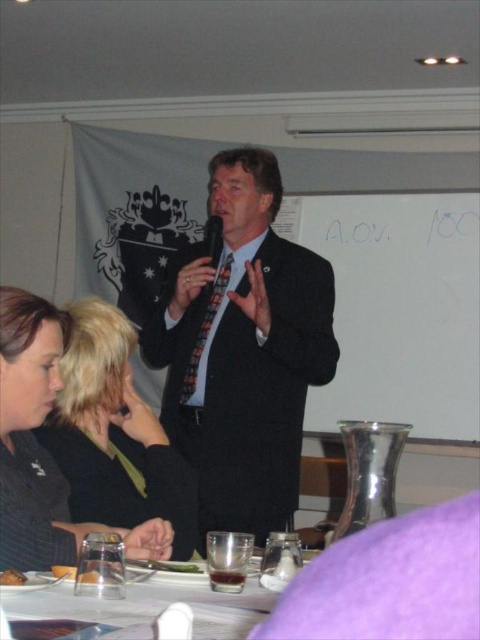
Based on the photo, does matte black suit at center have a lesser height compared to clear glass at lower center?

In fact, matte black suit at center may be taller than clear glass at lower center.

Is point (229, 326) behind point (236, 611)?

That is True.

At what (x,y) coordinates should I click in order to perform the action: click on matte black suit at center. Please return your answer as a coordinate pair (x, y). This screenshot has height=640, width=480. Looking at the image, I should click on (242, 349).

Is point (94, 317) less distant than point (202, 326)?

Yes, it is in front of point (202, 326).

The height and width of the screenshot is (640, 480). What do you see at coordinates (115, 435) in the screenshot?
I see `black fabric hair at center` at bounding box center [115, 435].

This screenshot has height=640, width=480. What are the coordinates of `black fabric hair at center` in the screenshot? It's located at (115, 435).

Is black fabric hair at center closer to camera compared to clear glass at lower center?

No, it is behind clear glass at lower center.

Is black fabric hair at center thinner than clear glass at lower center?

In fact, black fabric hair at center might be wider than clear glass at lower center.

Is point (144, 512) positioned in front of point (52, 605)?

No, (144, 512) is behind (52, 605).

The width and height of the screenshot is (480, 640). What are the coordinates of `black fabric hair at center` in the screenshot? It's located at (115, 435).